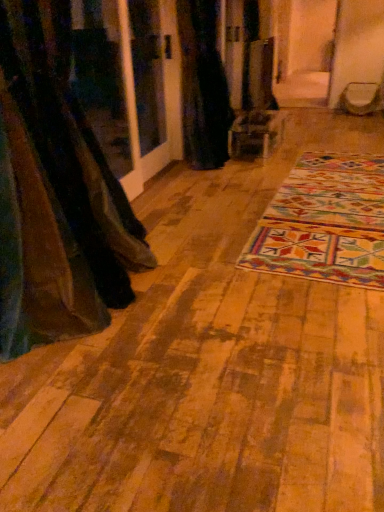
Identify the location of multicolored woven mat at center. (324, 222).

Could you tell me if black fabric curtain at center, which is the second curtain in front-to-back order, is facing multicolored woven mat at center?

No.

Is black fabric curtain at center, placed as the 1th curtain when sorted from top to bottom, not inside multicolored woven mat at center?

Yes, black fabric curtain at center, placed as the 1th curtain when sorted from top to bottom, is outside of multicolored woven mat at center.

From the image's perspective, does black fabric curtain at center, which is the second curtain in front-to-back order, appear higher than multicolored woven mat at center?

Yes, from the image's perspective, black fabric curtain at center, which is the second curtain in front-to-back order, is over multicolored woven mat at center.

Is black fabric curtain at center, placed as the 1th curtain when sorted from top to bottom, to the left or to the right of multicolored woven mat at center in the image?

black fabric curtain at center, placed as the 1th curtain when sorted from top to bottom, is to the left of multicolored woven mat at center.

Is the position of black fabric curtain at center, which appears as the 2th curtain when ordered from the bottom, less distant than that of brown fabric curtain at left, placed as the second curtain when sorted from top to bottom?

No.

Who is bigger, black fabric curtain at center, marked as the 1th curtain in a right-to-left arrangement, or brown fabric curtain at left, the 1th curtain viewed from the front?

brown fabric curtain at left, the 1th curtain viewed from the front, is bigger.

Is black fabric curtain at center, placed as the 1th curtain when sorted from top to bottom, next to brown fabric curtain at left, which is counted as the 1th curtain, starting from the left, and touching it?

No, black fabric curtain at center, placed as the 1th curtain when sorted from top to bottom, is not making contact with brown fabric curtain at left, which is counted as the 1th curtain, starting from the left.

From a real-world perspective, is black fabric curtain at center, which is the second curtain in front-to-back order, beneath brown fabric curtain at left, placed as the second curtain when sorted from top to bottom?

Incorrect, from a real-world perspective, black fabric curtain at center, which is the second curtain in front-to-back order, is higher than brown fabric curtain at left, placed as the second curtain when sorted from top to bottom.

Is multicolored woven mat at center to the right of black fabric curtain at center, the first curtain from the back, from the viewer's perspective?

Yes, multicolored woven mat at center is to the right of black fabric curtain at center, the first curtain from the back.

Is black fabric curtain at center, marked as the 1th curtain in a right-to-left arrangement, inside multicolored woven mat at center?

No, black fabric curtain at center, marked as the 1th curtain in a right-to-left arrangement, is located outside of multicolored woven mat at center.

Is multicolored woven mat at center aimed at black fabric curtain at center, which appears as the 2th curtain when ordered from the bottom?

No, multicolored woven mat at center is not facing towards black fabric curtain at center, which appears as the 2th curtain when ordered from the bottom.

Considering the positions of point (93, 246) and point (218, 89), is point (93, 246) closer or farther from the camera than point (218, 89)?

Point (93, 246).

Is brown fabric curtain at left, acting as the first curtain starting from the bottom, at the right side of black fabric curtain at center, marked as the 1th curtain in a right-to-left arrangement?

No, brown fabric curtain at left, acting as the first curtain starting from the bottom, is not to the right of black fabric curtain at center, marked as the 1th curtain in a right-to-left arrangement.

Is brown fabric curtain at left, acting as the first curtain starting from the bottom, looking in the opposite direction of black fabric curtain at center, which appears as the 2th curtain when ordered from the bottom?

brown fabric curtain at left, acting as the first curtain starting from the bottom, is not turned away from black fabric curtain at center, which appears as the 2th curtain when ordered from the bottom.

Is there a large distance between brown fabric curtain at left, acting as the second curtain starting from the back, and black fabric curtain at center, placed as the 1th curtain when sorted from top to bottom?

brown fabric curtain at left, acting as the second curtain starting from the back, is far away from black fabric curtain at center, placed as the 1th curtain when sorted from top to bottom.

Which is nearer, (96, 327) or (300, 203)?

Positioned in front is point (96, 327).

Which is correct: brown fabric curtain at left, the 1th curtain viewed from the front, is inside multicolored woven mat at center, or outside of it?

brown fabric curtain at left, the 1th curtain viewed from the front, is located beyond the bounds of multicolored woven mat at center.

Is brown fabric curtain at left, the 1th curtain viewed from the front, aimed at multicolored woven mat at center?

No, brown fabric curtain at left, the 1th curtain viewed from the front, is not aimed at multicolored woven mat at center.

Are brown fabric curtain at left, acting as the second curtain starting from the back, and multicolored woven mat at center far apart?

Yes, brown fabric curtain at left, acting as the second curtain starting from the back, is far from multicolored woven mat at center.

Is multicolored woven mat at center outside of brown fabric curtain at left, the 1th curtain viewed from the front?

Yes.

From the image's perspective, is multicolored woven mat at center located beneath brown fabric curtain at left, acting as the first curtain starting from the bottom?

No, from the image's perspective, multicolored woven mat at center is not beneath brown fabric curtain at left, acting as the first curtain starting from the bottom.

Which object is wider, multicolored woven mat at center or brown fabric curtain at left, which is counted as the 1th curtain, starting from the left?

With larger width is multicolored woven mat at center.

Who is smaller, multicolored woven mat at center or brown fabric curtain at left, which appears as the second curtain when viewed from the right?

Smaller between the two is multicolored woven mat at center.

The height and width of the screenshot is (512, 384). In order to click on curtain above the multicolored woven mat at center (from the image's perspective) in this screenshot , I will do `click(203, 85)`.

Where is `curtain lying on the right of brown fabric curtain at left, acting as the second curtain starting from the back`? This screenshot has width=384, height=512. curtain lying on the right of brown fabric curtain at left, acting as the second curtain starting from the back is located at coordinates (203, 85).

Which object lies further to the anchor point brown fabric curtain at left, placed as the second curtain when sorted from top to bottom, multicolored woven mat at center or black fabric curtain at center, marked as the 1th curtain in a right-to-left arrangement?

The object further to brown fabric curtain at left, placed as the second curtain when sorted from top to bottom, is black fabric curtain at center, marked as the 1th curtain in a right-to-left arrangement.

Estimate the real-world distances between objects in this image. Which object is closer to black fabric curtain at center, marked as the second curtain in a left-to-right arrangement, multicolored woven mat at center or brown fabric curtain at left, which is counted as the 1th curtain, starting from the left?

Based on the image, multicolored woven mat at center appears to be nearer to black fabric curtain at center, marked as the second curtain in a left-to-right arrangement.

Looking at the image, which one is located further to multicolored woven mat at center, brown fabric curtain at left, which is counted as the 1th curtain, starting from the left, or black fabric curtain at center, the first curtain from the back?

black fabric curtain at center, the first curtain from the back, is positioned further to the anchor multicolored woven mat at center.

When comparing their distances from brown fabric curtain at left, which appears as the second curtain when viewed from the right, does black fabric curtain at center, which appears as the 2th curtain when ordered from the bottom, or multicolored woven mat at center seem further?

Based on the image, black fabric curtain at center, which appears as the 2th curtain when ordered from the bottom, appears to be further to brown fabric curtain at left, which appears as the second curtain when viewed from the right.

Looking at the image, which one is located closer to black fabric curtain at center, marked as the 1th curtain in a right-to-left arrangement, brown fabric curtain at left, acting as the second curtain starting from the back, or multicolored woven mat at center?

multicolored woven mat at center is closer to black fabric curtain at center, marked as the 1th curtain in a right-to-left arrangement.

When comparing their distances from multicolored woven mat at center, does black fabric curtain at center, marked as the second curtain in a left-to-right arrangement, or brown fabric curtain at left, which is counted as the 1th curtain, starting from the left, seem closer?

brown fabric curtain at left, which is counted as the 1th curtain, starting from the left, lies closer to multicolored woven mat at center than the other object.

I want to click on mat between brown fabric curtain at left, placed as the second curtain when sorted from top to bottom, and black fabric curtain at center, the first curtain from the back, from front to back, so click(x=324, y=222).